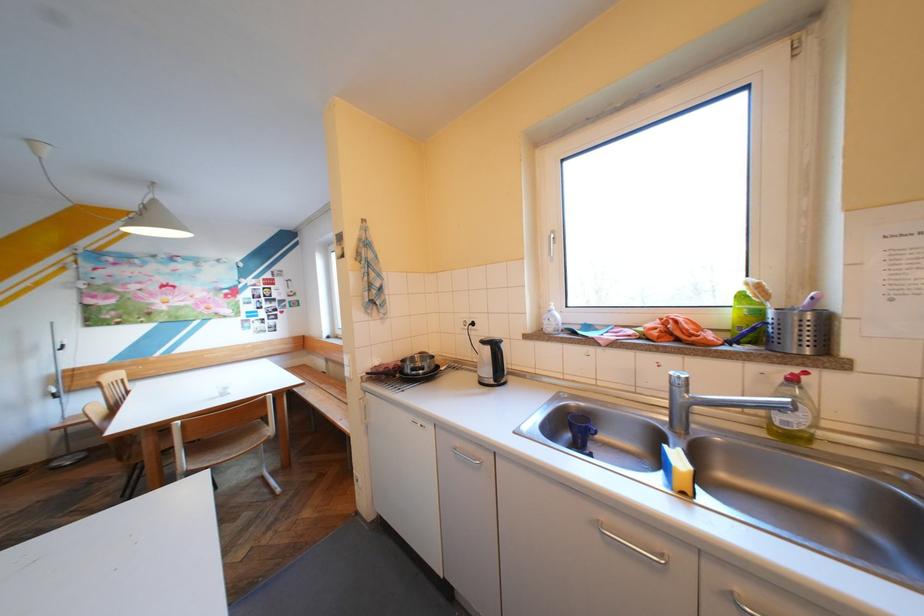
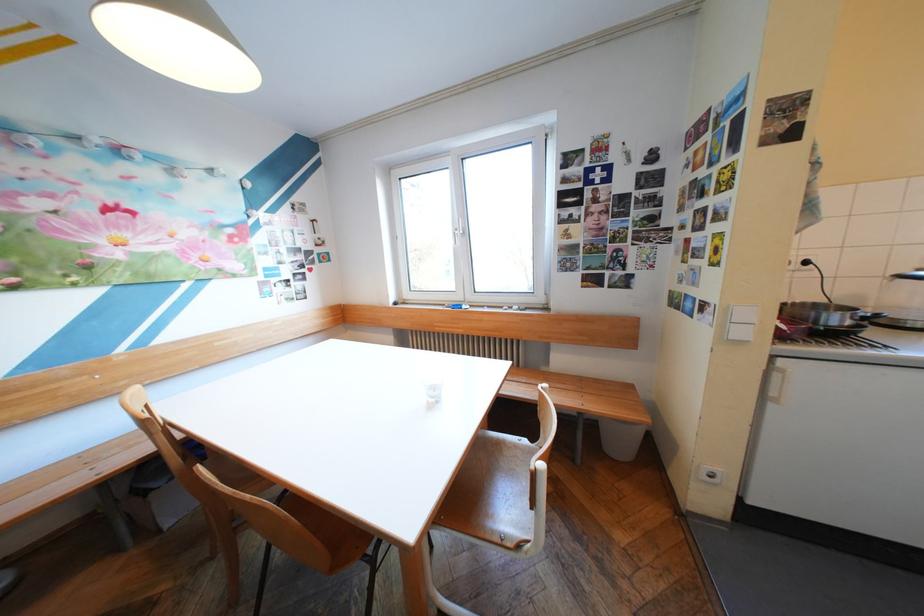
The point at (485, 315) is marked in the first image. Where is the corresponding point in the second image?

(816, 252)